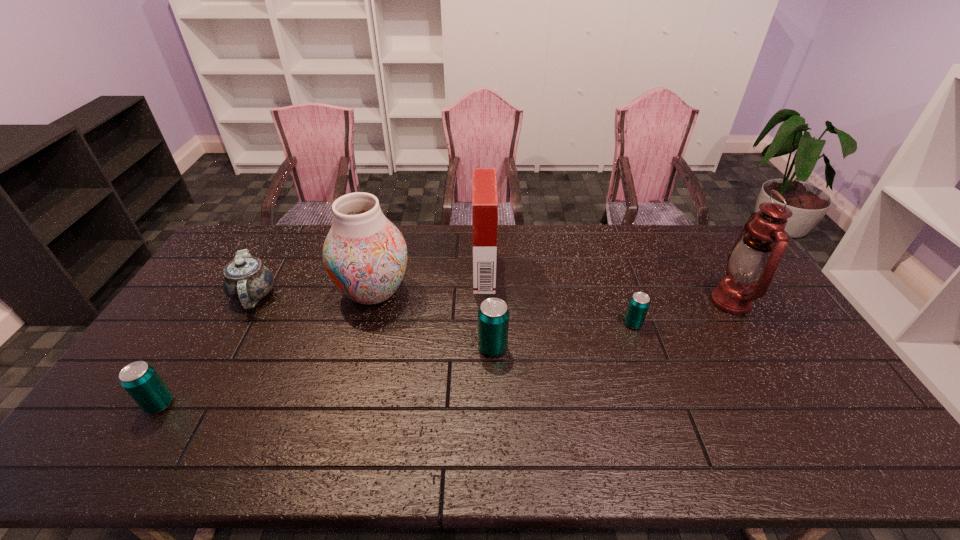
At what (x,y) coordinates should I click in order to perform the action: click on object at the near edge. Please return your answer as a coordinate pair (x, y). The width and height of the screenshot is (960, 540). Looking at the image, I should click on pos(140,380).

Where is `beer can that is at the left edge`? The height and width of the screenshot is (540, 960). beer can that is at the left edge is located at coordinates (140, 380).

Where is `chinaware present at the left edge`? The width and height of the screenshot is (960, 540). chinaware present at the left edge is located at coordinates (246, 280).

Locate an element on the screen. Image resolution: width=960 pixels, height=540 pixels. object at the right edge is located at coordinates (756, 255).

Identify the location of object located in the near left corner section of the desktop. (140, 380).

This screenshot has height=540, width=960. I want to click on free space at the far edge of the desktop, so click(300, 231).

In the image, there is a desktop. Identify the location of vacant space at the near edge. (298, 396).

The width and height of the screenshot is (960, 540). In the image, there is a desktop. What are the coordinates of `free space at the far right corner` in the screenshot? It's located at (712, 231).

In the image, there is a desktop. Identify the location of vacant space at the near right corner. The image size is (960, 540). (834, 412).

Locate an element on the screen. The image size is (960, 540). free space between the cigarette_case and the oil lamp is located at coordinates (608, 287).